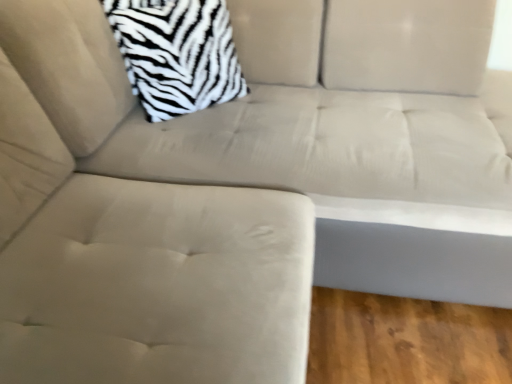
The width and height of the screenshot is (512, 384). What are the coordinates of `zebra-patterned fabric pillow at upper left` in the screenshot? It's located at (177, 54).

This screenshot has width=512, height=384. Describe the element at coordinates (177, 54) in the screenshot. I see `zebra-patterned fabric pillow at upper left` at that location.

What is the approximate height of suede beige swivel chair at center?

The height of suede beige swivel chair at center is 36.17 inches.

Where is `suede beige swivel chair at center`? The image size is (512, 384). suede beige swivel chair at center is located at coordinates (158, 286).

Describe the element at coordinates (158, 286) in the screenshot. Image resolution: width=512 pixels, height=384 pixels. I see `suede beige swivel chair at center` at that location.

You are a GUI agent. You are given a task and a screenshot of the screen. Output one action in this format:
    pyautogui.click(x=<x>, y=<y>)
    Task: Click on the zebra-patterned fabric pillow at upper left
    
    Given the screenshot: What is the action you would take?
    pyautogui.click(x=177, y=54)

Is zebra-patterned fabric pillow at upper left at the left side of suede beige swivel chair at center?

In fact, zebra-patterned fabric pillow at upper left is to the right of suede beige swivel chair at center.

Is zebra-patterned fabric pillow at upper left further to camera compared to suede beige swivel chair at center?

Yes, it is behind suede beige swivel chair at center.

Considering the points (132, 4) and (69, 226), which point is behind, point (132, 4) or point (69, 226)?

The point (132, 4) is farther.

From the image's perspective, relative to suede beige swivel chair at center, is zebra-patterned fabric pillow at upper left above or below?

Clearly, from the image's perspective, zebra-patterned fabric pillow at upper left is above suede beige swivel chair at center.

From a real-world perspective, is zebra-patterned fabric pillow at upper left on suede beige swivel chair at center?

Yes, from a real-world perspective, zebra-patterned fabric pillow at upper left is on top of suede beige swivel chair at center.

Is zebra-patterned fabric pillow at upper left wider than suede beige swivel chair at center?

Incorrect, the width of zebra-patterned fabric pillow at upper left does not surpass that of suede beige swivel chair at center.

Can you confirm if zebra-patterned fabric pillow at upper left is taller than suede beige swivel chair at center?

No.

Who is smaller, zebra-patterned fabric pillow at upper left or suede beige swivel chair at center?

Smaller between the two is zebra-patterned fabric pillow at upper left.

Is zebra-patterned fabric pillow at upper left positioned beyond the bounds of suede beige swivel chair at center?

Yes, zebra-patterned fabric pillow at upper left is outside of suede beige swivel chair at center.

Is zebra-patterned fabric pillow at upper left beside suede beige swivel chair at center?

No, zebra-patterned fabric pillow at upper left is not touching suede beige swivel chair at center.

Looking at this image, is zebra-patterned fabric pillow at upper left aimed at suede beige swivel chair at center?

No, zebra-patterned fabric pillow at upper left does not turn towards suede beige swivel chair at center.

How many degrees apart are the facing directions of zebra-patterned fabric pillow at upper left and suede beige swivel chair at center?

The angular difference between zebra-patterned fabric pillow at upper left and suede beige swivel chair at center is 38.9 degrees.

Measure the distance from zebra-patterned fabric pillow at upper left to suede beige swivel chair at center.

They are 22.84 inches apart.

This screenshot has height=384, width=512. I want to click on swivel chair directly beneath the zebra-patterned fabric pillow at upper left (from a real-world perspective), so click(x=158, y=286).

Based on the photo, considering the relative positions of suede beige swivel chair at center and zebra-patterned fabric pillow at upper left in the image provided, is suede beige swivel chair at center to the left or to the right of zebra-patterned fabric pillow at upper left?

Clearly, suede beige swivel chair at center is on the left of zebra-patterned fabric pillow at upper left in the image.

Based on the photo, who is more distant, suede beige swivel chair at center or zebra-patterned fabric pillow at upper left?

zebra-patterned fabric pillow at upper left is behind.

Which point is more forward, (x=79, y=344) or (x=220, y=40)?

The point (x=79, y=344) is in front.

From the image's perspective, who appears lower, suede beige swivel chair at center or zebra-patterned fabric pillow at upper left?

suede beige swivel chair at center, from the image's perspective.

From a real-world perspective, is suede beige swivel chair at center above or below zebra-patterned fabric pillow at upper left?

In terms of real-world spatial position, suede beige swivel chair at center is below zebra-patterned fabric pillow at upper left.

Is suede beige swivel chair at center thinner than zebra-patterned fabric pillow at upper left?

Incorrect, the width of suede beige swivel chair at center is not less than that of zebra-patterned fabric pillow at upper left.

Which of these two, suede beige swivel chair at center or zebra-patterned fabric pillow at upper left, stands taller?

Standing taller between the two is suede beige swivel chair at center.

Which of these two, suede beige swivel chair at center or zebra-patterned fabric pillow at upper left, is bigger?

Bigger between the two is suede beige swivel chair at center.

In the scene shown: Is suede beige swivel chair at center located outside zebra-patterned fabric pillow at upper left?

Yes.

Would you consider suede beige swivel chair at center to be distant from zebra-patterned fabric pillow at upper left?

No, there isn't a large distance between suede beige swivel chair at center and zebra-patterned fabric pillow at upper left.

Is suede beige swivel chair at center facing away from zebra-patterned fabric pillow at upper left?

No, suede beige swivel chair at center's orientation is not away from zebra-patterned fabric pillow at upper left.

How many degrees apart are the facing directions of suede beige swivel chair at center and zebra-patterned fabric pillow at upper left?

They differ by 38.9 degrees in their facing directions.

Identify the location of swivel chair on the left of zebra-patterned fabric pillow at upper left. The image size is (512, 384). (158, 286).

Where is `throw pillow behind the suede beige swivel chair at center`? The image size is (512, 384). throw pillow behind the suede beige swivel chair at center is located at coordinates (177, 54).

You are a GUI agent. You are given a task and a screenshot of the screen. Output one action in this format:
    pyautogui.click(x=<x>, y=<y>)
    Task: Click on the swivel chair below the zebra-patterned fabric pillow at upper left (from the image's perspective)
    
    Given the screenshot: What is the action you would take?
    [158, 286]